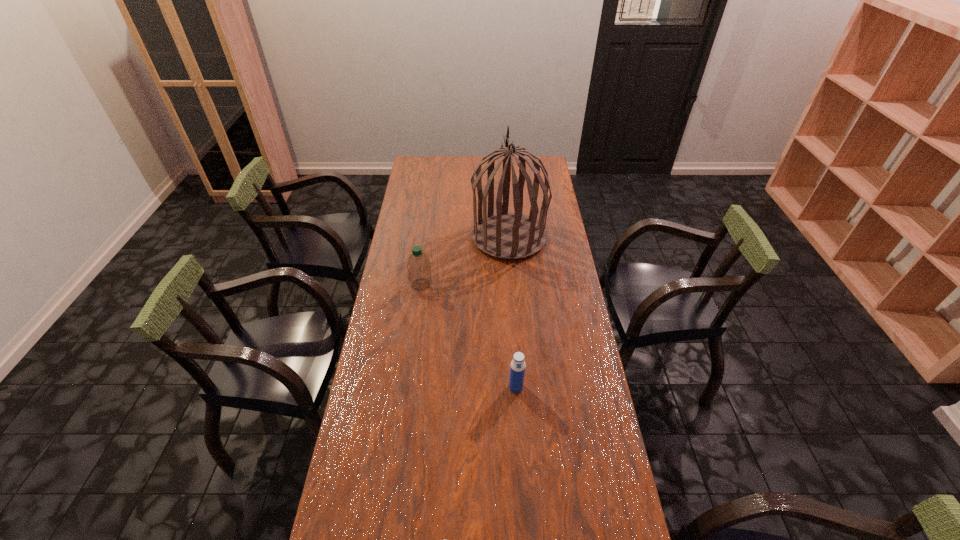
Locate an element on the screen. This screenshot has height=540, width=960. the farthest object is located at coordinates (508, 235).

Identify the location of the tallest object. The image size is (960, 540). (508, 235).

The width and height of the screenshot is (960, 540). Find the location of `the second farthest object`. the second farthest object is located at coordinates [x=419, y=267].

In order to click on the leftmost object in this screenshot , I will do pos(419,267).

Where is `the rightmost water bottle`? The height and width of the screenshot is (540, 960). the rightmost water bottle is located at coordinates (517, 368).

Where is `the second farthest water bottle`? the second farthest water bottle is located at coordinates (517, 368).

You are a GUI agent. You are given a task and a screenshot of the screen. Output one action in this format:
    pyautogui.click(x=<x>, y=<y>)
    Task: Click on the vacant space located on the front of the tallest object
    
    Given the screenshot: What is the action you would take?
    pyautogui.click(x=516, y=330)

Locate an element on the screen. vacant space located on the right of the farthest water bottle is located at coordinates (522, 285).

Identify the location of free space located on the back of the second nearest water bottle. Image resolution: width=960 pixels, height=540 pixels. (514, 358).

Where is `object at the left edge`? The height and width of the screenshot is (540, 960). object at the left edge is located at coordinates (419, 267).